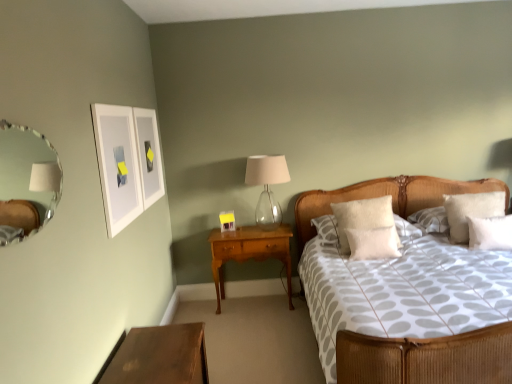
Question: Does point (482, 243) appear closer or farther from the camera than point (93, 107)?

Choices:
 (A) closer
 (B) farther

Answer: (B)

Question: Is white soft pillow at right, positioned as the 3th pillow in left-to-right order, to the left or to the right of white matte picture frame at upper left in the image?

Choices:
 (A) right
 (B) left

Answer: (A)

Question: Which is farther from the white matte picture frame at upper left?

Choices:
 (A) woven wood bed at center
 (B) clear glass mirror at upper left
 (C) white soft pillow at center, the 2th pillow positioned from the left
 (D) clear glass table lamp at center
 (E) wooden nightstand at center, placed as the 1th nightstand when sorted from back to front

Answer: (A)

Question: Considering the real-world distances, which object is farthest from the white soft pillow at center, the 2th pillow positioned from the left?

Choices:
 (A) white soft pillow at right, positioned as the 3th pillow in left-to-right order
 (B) wooden nightstand at center, positioned as the first nightstand in right-to-left order
 (C) woven wood bed at center
 (D) clear glass mirror at upper left
 (E) white matte picture frame at upper left

Answer: (D)